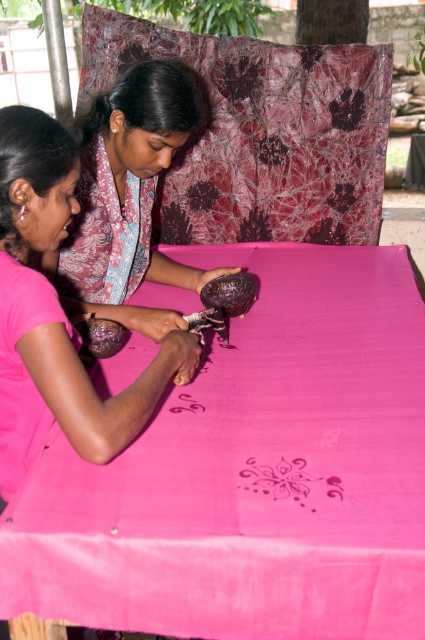
Between pink silk scarf at upper left and pink matte fabric at center, which one has less height?

With less height is pink matte fabric at center.

Can you confirm if pink silk scarf at upper left is bigger than pink matte fabric at center?

Yes, pink silk scarf at upper left is bigger than pink matte fabric at center.

Which is behind, point (125, 262) or point (248, 488)?

Point (125, 262)

Where is `pink silk scarf at upper left`? The height and width of the screenshot is (640, 425). pink silk scarf at upper left is located at coordinates (107, 234).

Is pink matte shirt at lower left positioned behind matte purple bowl at upper center?

That is False.

Is pink matte shirt at lower left bigger than matte purple bowl at upper center?

No, pink matte shirt at lower left is not bigger than matte purple bowl at upper center.

I want to click on pink matte shirt at lower left, so click(x=54, y=314).

From the picture: Does pink fabric at lower left appear on the left side of pink matte fabric at center?

Yes, pink fabric at lower left is to the left of pink matte fabric at center.

Is pink fabric at lower left thinner than pink matte fabric at center?

Yes.

Between point (10, 301) and point (306, 467), which one is positioned behind?

The point (306, 467) is behind.

The width and height of the screenshot is (425, 640). Identify the location of pink fabric at lower left. (22, 369).